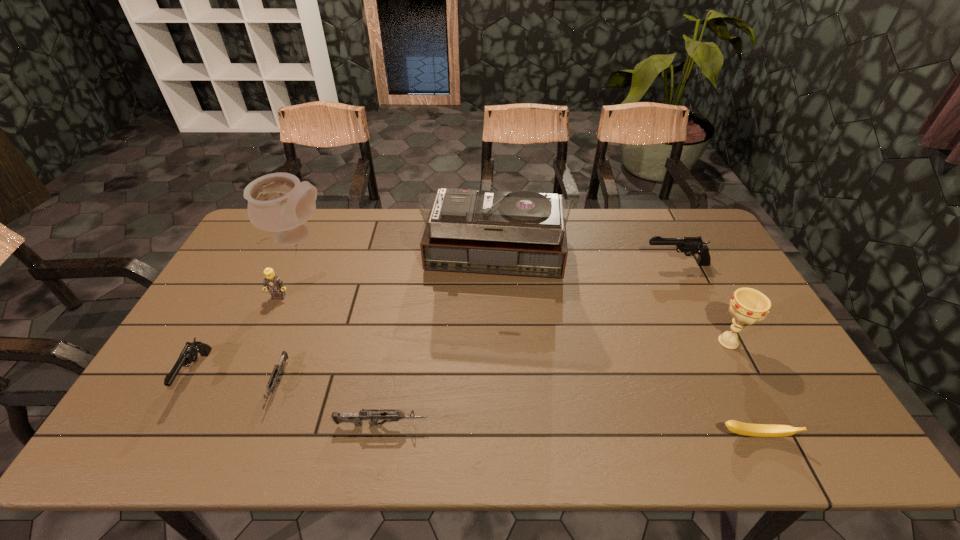
Identify the location of gun that is positioned at the left edge. (189, 354).

I want to click on chalice positioned at the right edge, so click(748, 306).

Locate an element on the screen. The width and height of the screenshot is (960, 540). gun positioned at the right edge is located at coordinates [x=689, y=246].

The width and height of the screenshot is (960, 540). In order to click on banana present at the right edge in this screenshot , I will do `click(756, 430)`.

Locate an element on the screen. object located in the far left corner section of the desktop is located at coordinates (278, 202).

You are a GUI agent. You are given a task and a screenshot of the screen. Output one action in this format:
    pyautogui.click(x=<x>, y=<y>)
    Task: Click on the object present at the near right corner
    
    Given the screenshot: What is the action you would take?
    pyautogui.click(x=756, y=430)

The image size is (960, 540). I want to click on vacant area at the far edge, so click(386, 247).

At what (x,y) coordinates should I click in order to perform the action: click on free space at the near edge. Please return your answer as a coordinate pair (x, y). Image resolution: width=960 pixels, height=540 pixels. Looking at the image, I should click on (584, 436).

I want to click on vacant space at the left edge, so click(x=234, y=304).

This screenshot has width=960, height=540. In the image, there is a desktop. In order to click on vacant area at the far right corner in this screenshot , I will do `click(665, 211)`.